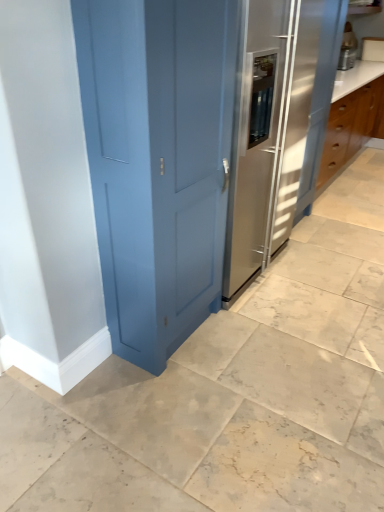
Question: Is satin stainless steel fridge at center bigger or smaller than metallic silver appliance at upper right?

Choices:
 (A) big
 (B) small

Answer: (A)

Question: In terms of height, does satin stainless steel fridge at center look taller or shorter compared to metallic silver appliance at upper right?

Choices:
 (A) short
 (B) tall

Answer: (B)

Question: Is satin stainless steel fridge at center wider or thinner than metallic silver appliance at upper right?

Choices:
 (A) thin
 (B) wide

Answer: (B)

Question: Do you think metallic silver appliance at upper right is within satin stainless steel fridge at center, or outside of it?

Choices:
 (A) inside
 (B) outside

Answer: (B)

Question: From the image's perspective, is metallic silver appliance at upper right above or below satin stainless steel fridge at center?

Choices:
 (A) above
 (B) below

Answer: (A)

Question: In the image, is metallic silver appliance at upper right positioned in front of or behind satin stainless steel fridge at center?

Choices:
 (A) behind
 (B) front

Answer: (A)

Question: From a real-world perspective, is metallic silver appliance at upper right physically located above or below satin stainless steel fridge at center?

Choices:
 (A) above
 (B) below

Answer: (A)